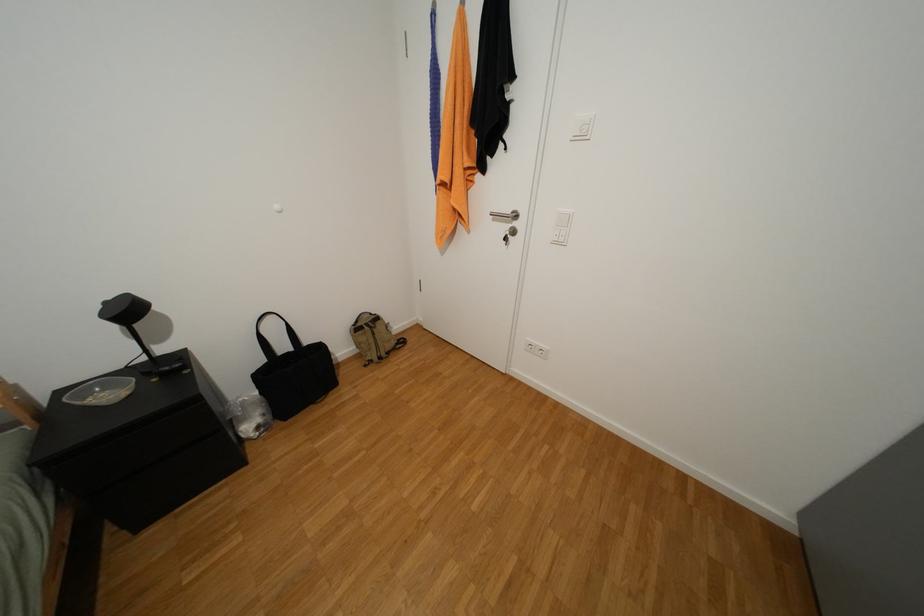
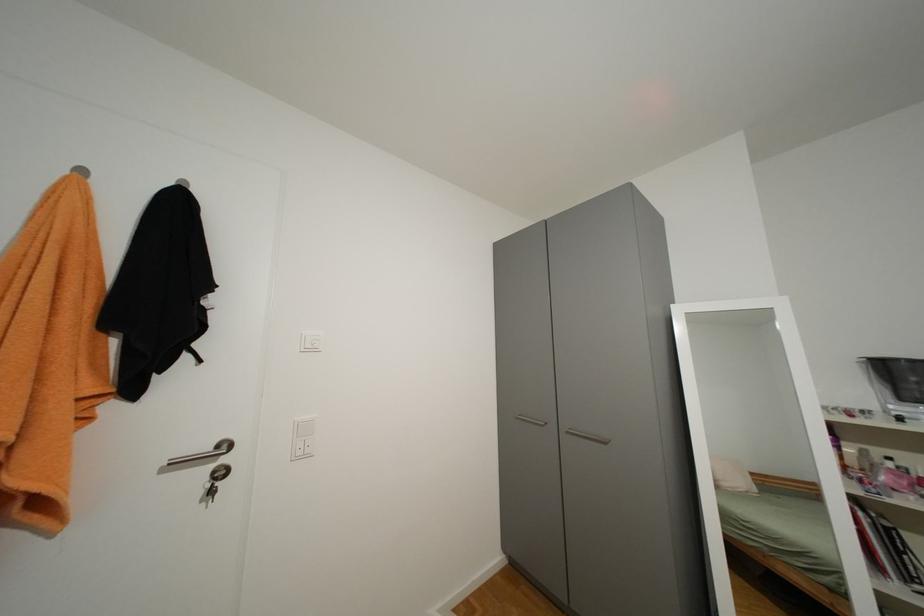
Question: The camera is either moving clockwise (left) or counter-clockwise (right) around the object. The first image is from the beginning of the video and the second image is from the end. Is the camera moving left or right when shooting the video?

Choices:
 (A) Left
 (B) Right

Answer: (A)